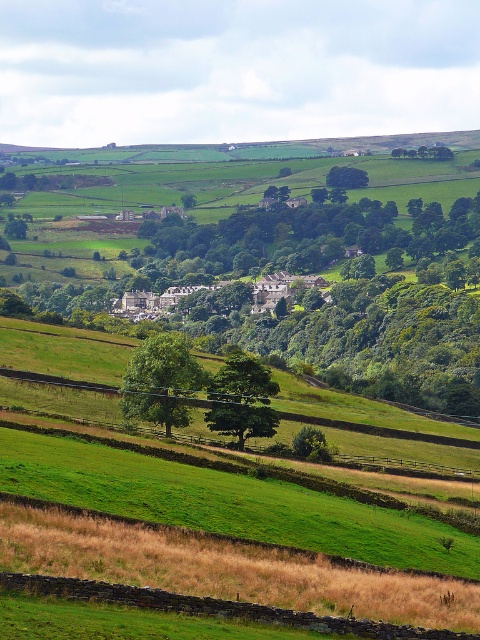
Question: Which of these objects is positioned farthest from the green leafy tree at upper center?

Choices:
 (A) green leafy tree at lower center
 (B) green leafy tree at center

Answer: (A)

Question: Does green leafy tree at center appear on the right side of green leafy tree at upper center?

Choices:
 (A) yes
 (B) no

Answer: (B)

Question: Can you confirm if green leafy tree at lower center is positioned below green leafy tree at center?

Choices:
 (A) no
 (B) yes

Answer: (A)

Question: Which of the following is the closest to the observer?

Choices:
 (A) (178, 353)
 (B) (207, 424)
 (C) (218, 284)

Answer: (A)

Question: Which point is closer to the camera taking this photo?

Choices:
 (A) (156, 364)
 (B) (149, 298)

Answer: (A)

Question: Does green leafy tree at lower center lie behind green leafy tree at center?

Choices:
 (A) yes
 (B) no

Answer: (B)